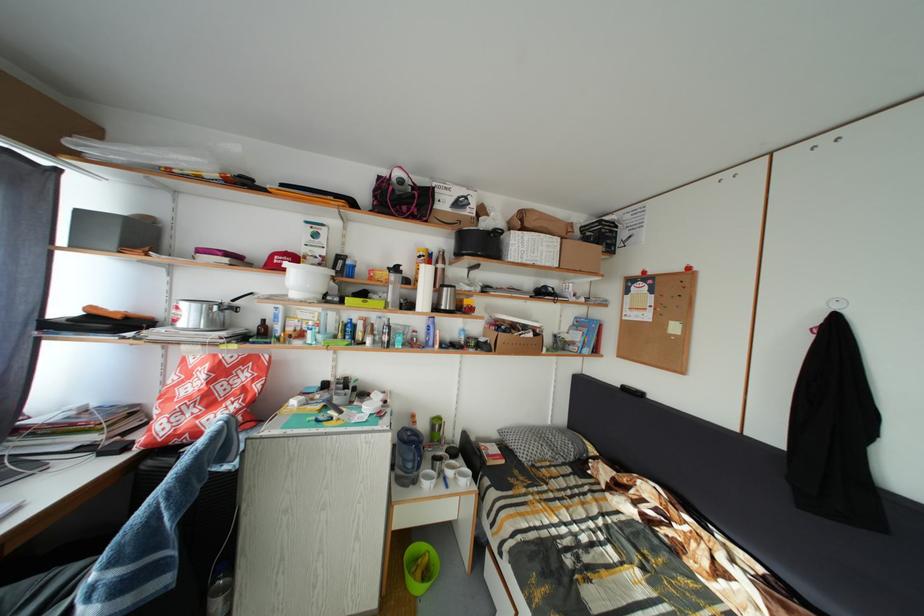
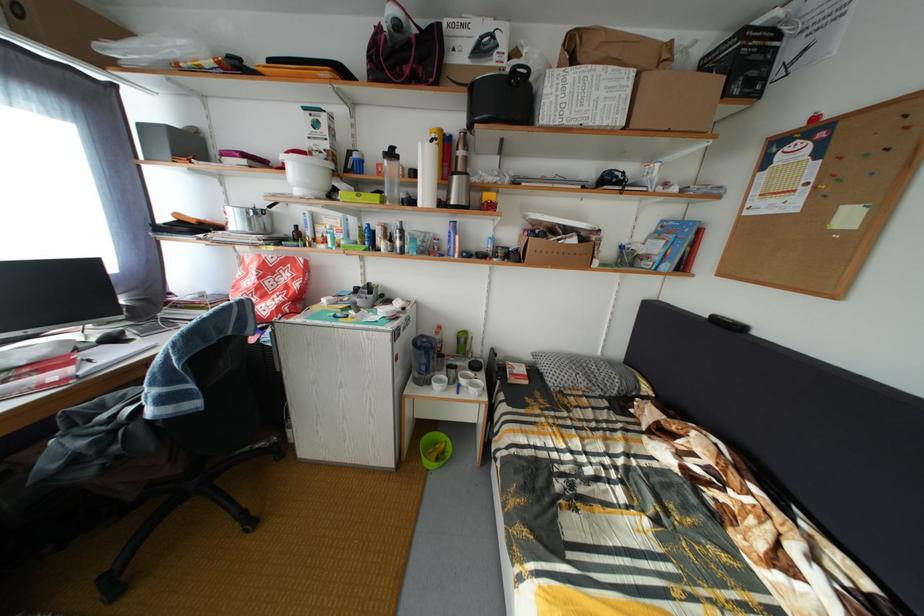
In the second image, find the point that corresponds to point 415,445 in the first image.

(428, 350)